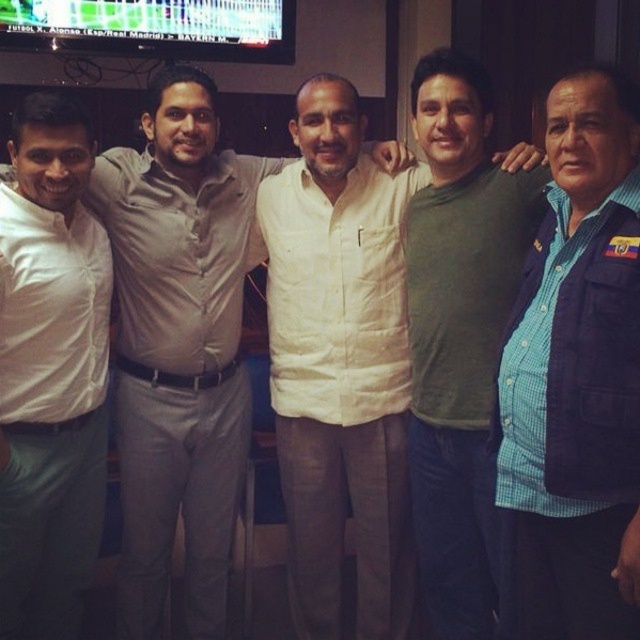
Where is `white shirt at center`? The image size is (640, 640). white shirt at center is located at coordinates (179, 344).

Can you confirm if white shirt at center is positioned to the right of white matte shirt at left?

Correct, you'll find white shirt at center to the right of white matte shirt at left.

Where is `white shirt at center`? The width and height of the screenshot is (640, 640). white shirt at center is located at coordinates (179, 344).

Where is `white shirt at center`? This screenshot has height=640, width=640. white shirt at center is located at coordinates (179, 344).

Between blue checkered shirt at right and white shirt at center, which one has more height?

white shirt at center

Does point (576, 371) lie in front of point (208, 442)?

Yes, point (576, 371) is closer to viewer.

Where is `blue checkered shirt at right`? This screenshot has height=640, width=640. blue checkered shirt at right is located at coordinates (577, 376).

Which of these two, blue checkered shirt at right or green matte shirt at center, stands taller?

green matte shirt at center is taller.

Is point (632, 452) more distant than point (492, 205)?

No, it is in front of (492, 205).

This screenshot has width=640, height=640. Find the location of `blue checkered shirt at right`. blue checkered shirt at right is located at coordinates (577, 376).